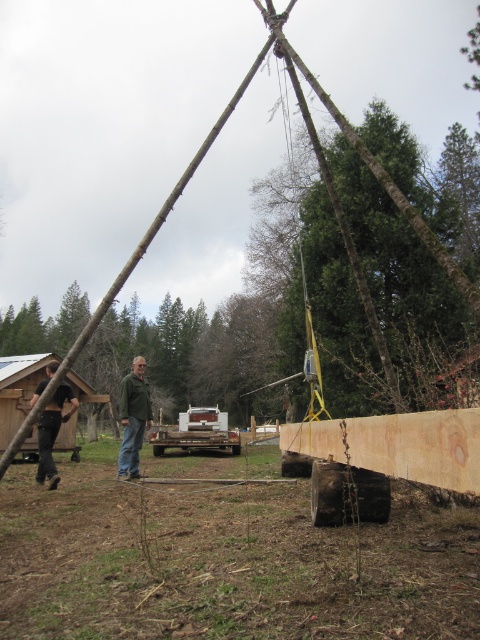
You are a construction worker planning to lift the brown wood tree at center and the black leather pants at lower left using a crane. Since the crane can only lift items taller than 2 meters, can both items be lifted safely?

The brown wood tree at center is taller than black leather pants at lower left. Since the crane requires items taller than 2 meters to be lifted safely, we need to know the exact height of the brown wood tree at center. However, the description only states it is taller than the black leather pants at lower left. Without specific measurements for either item, we cannot confirm if the brown wood tree at center meets the 2 meter requirement. The black leather pants at lower left is definitely shorter than the

You are a construction worker standing at the edge of the construction site. You need to move a heavy tool from the brown wood tree at center to the black leather pants at lower left. In which direction should you move the tool?

The brown wood tree at center is to the left of black leather pants at lower left, so you should move the tool to the right direction towards the black leather pants at lower left.

Consider the image. You are a construction worker who needs to lift the green matte jacket at center over the brown wood tree at center. Can you do this without the jacket touching the tree?

The brown wood tree at center is taller than the green matte jacket at center. Since the tree is taller, lifting the jacket over it would require raising it above the tree, which may be possible depending on the worker and equipment available. However, the description does not provide information about the jacket or tree dimensions beyond height, so it is unclear if the jacket can be maneuvered without touching the tree.